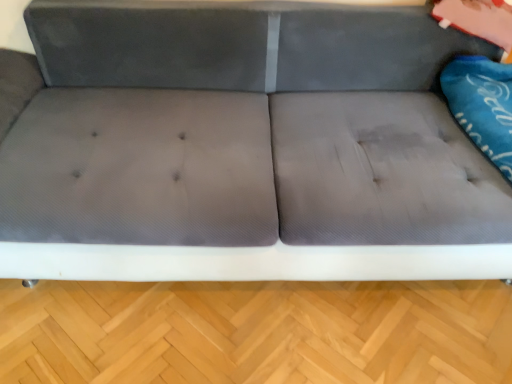
What do you see at coordinates (482, 105) in the screenshot?
I see `blue fabric pillow at right` at bounding box center [482, 105].

You are a GUI agent. You are given a task and a screenshot of the screen. Output one action in this format:
    pyautogui.click(x=<x>, y=<y>)
    Task: Click on the blue fabric pillow at right
    This screenshot has height=384, width=512.
    Given the screenshot: What is the action you would take?
    pyautogui.click(x=482, y=105)

The image size is (512, 384). Identify the location of blue fabric pillow at right. (482, 105).